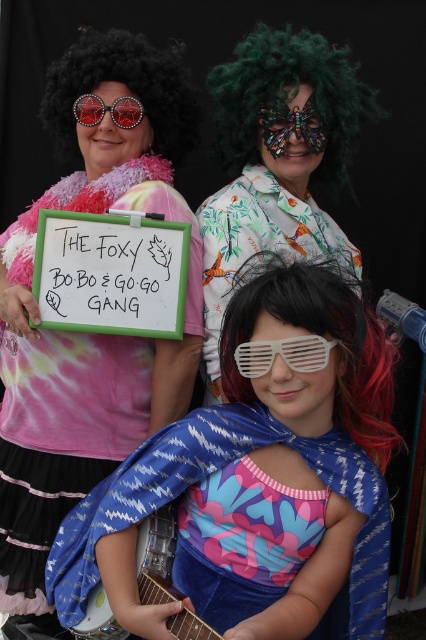
Question: Which object is the closest to the red reflective sunglasses at upper left?

Choices:
 (A) green curly wig at upper center
 (B) black curly wig at upper left

Answer: (B)

Question: Which point is farther from the camera taking this photo?

Choices:
 (A) (265, 102)
 (B) (354, 384)

Answer: (A)

Question: Is black curly wig at upper left to the left of white plastic goggles at center from the viewer's perspective?

Choices:
 (A) yes
 (B) no

Answer: (A)

Question: Which of the following is the farthest from the observer?

Choices:
 (A) (299, 273)
 (B) (132, 97)
 (C) (154, 589)

Answer: (B)

Question: Is tie-dye fabric shirt at upper left below white plastic goggles at center?

Choices:
 (A) yes
 (B) no

Answer: (B)

Question: Is tie-dye fabric shirt at upper left further to the viewer compared to black matte wig at center?

Choices:
 (A) yes
 (B) no

Answer: (A)